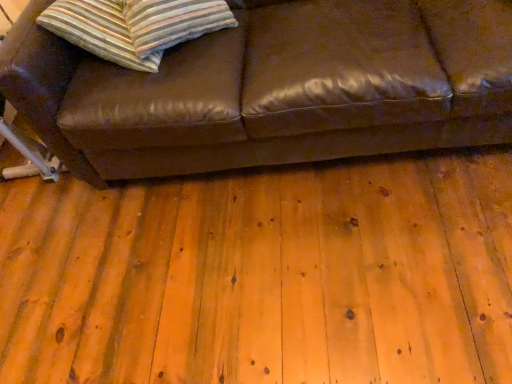
What is the approximate height of brown leather couch at upper center?

brown leather couch at upper center is 85.41 centimeters in height.

This screenshot has width=512, height=384. In order to click on brown leather couch at upper center in this screenshot , I will do `click(273, 88)`.

What do you see at coordinates (273, 88) in the screenshot?
I see `brown leather couch at upper center` at bounding box center [273, 88].

Where is `brown leather couch at upper center`? brown leather couch at upper center is located at coordinates (273, 88).